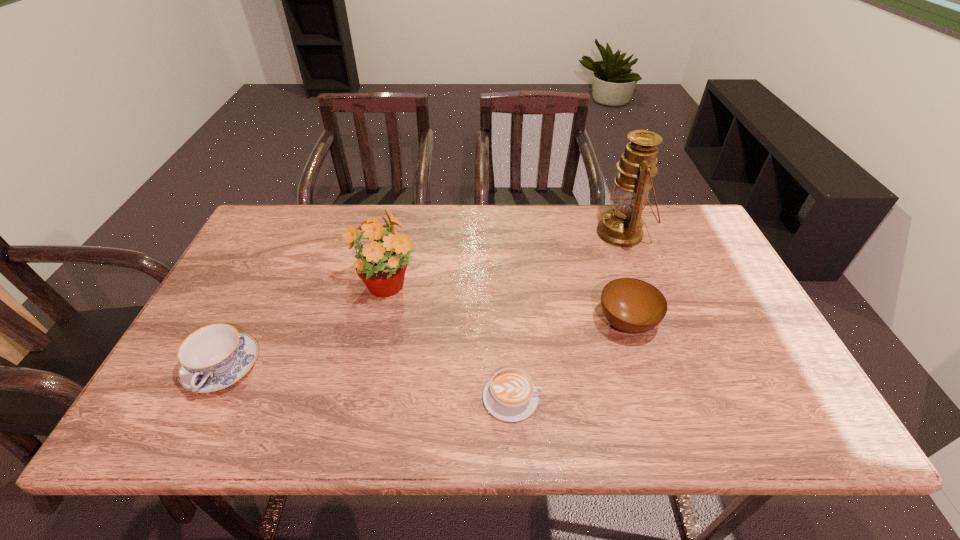
Where is `free space between the flowerpot and the bowl`? free space between the flowerpot and the bowl is located at coordinates (507, 307).

Where is `vacant space that is in between the flowerpot and the third object from left to right`? vacant space that is in between the flowerpot and the third object from left to right is located at coordinates (450, 343).

Where is `free spot between the second object from left to right and the oil lamp`? The width and height of the screenshot is (960, 540). free spot between the second object from left to right and the oil lamp is located at coordinates (505, 261).

Identify the location of object that stands as the fourth closest to the bowl. This screenshot has height=540, width=960. (214, 357).

Identify which object is the third closest to the cappuccino. Please provide its 2D coordinates. Your answer should be formatted as a tuple, i.e. [(x, y)], where the tuple contains the x and y coordinates of a point satisfying the conditions above.

[(621, 226)]

Where is `vacant region that satisfies the following two spatial constraints: 1. on the back side of the bowl; 2. on the right side of the oil lamp`? vacant region that satisfies the following two spatial constraints: 1. on the back side of the bowl; 2. on the right side of the oil lamp is located at coordinates (598, 233).